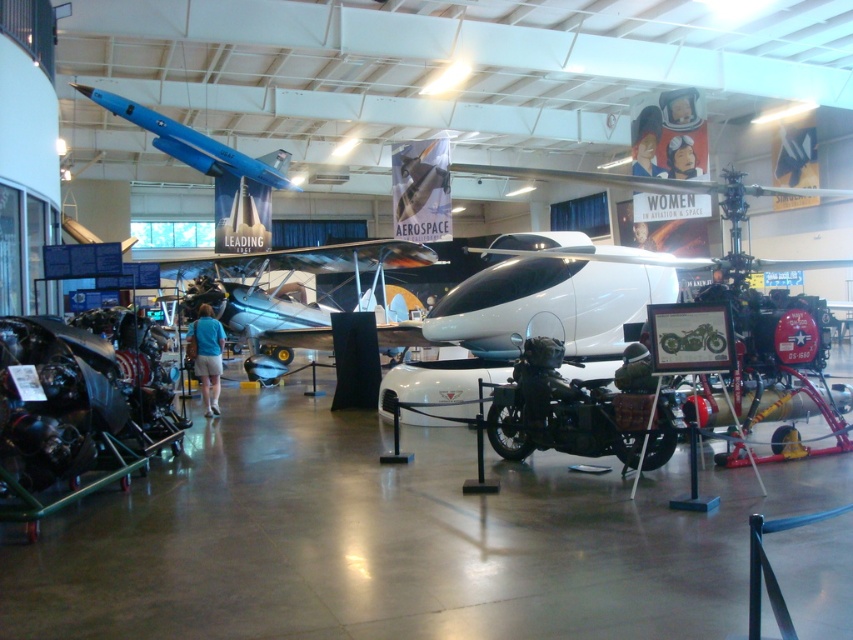
Does silver metallic airplane at center have a lesser width compared to blue matte airplane at upper center?

Yes.

Which is more to the right, silver metallic airplane at center or blue matte airplane at upper center?

From the viewer's perspective, silver metallic airplane at center appears more on the right side.

Who is more forward, (294, 336) or (230, 164)?

Point (294, 336) is more forward.

This screenshot has height=640, width=853. I want to click on silver metallic airplane at center, so click(286, 288).

Can you confirm if shiny black motorcycle at center is positioned to the right of blue matte airplane at upper center?

Yes, shiny black motorcycle at center is to the right of blue matte airplane at upper center.

Who is shorter, shiny black motorcycle at center or blue matte airplane at upper center?

With less height is shiny black motorcycle at center.

Where is `shiny black motorcycle at center`? shiny black motorcycle at center is located at coordinates (578, 410).

Which is more to the right, shiny black motorcycle at center or silver metallic airplane at center?

From the viewer's perspective, shiny black motorcycle at center appears more on the right side.

What do you see at coordinates (578, 410) in the screenshot?
I see `shiny black motorcycle at center` at bounding box center [578, 410].

Which is in front, point (608, 394) or point (213, 292)?

Point (608, 394) is in front.

Find the location of a particular element. The width and height of the screenshot is (853, 640). shiny black motorcycle at center is located at coordinates (578, 410).